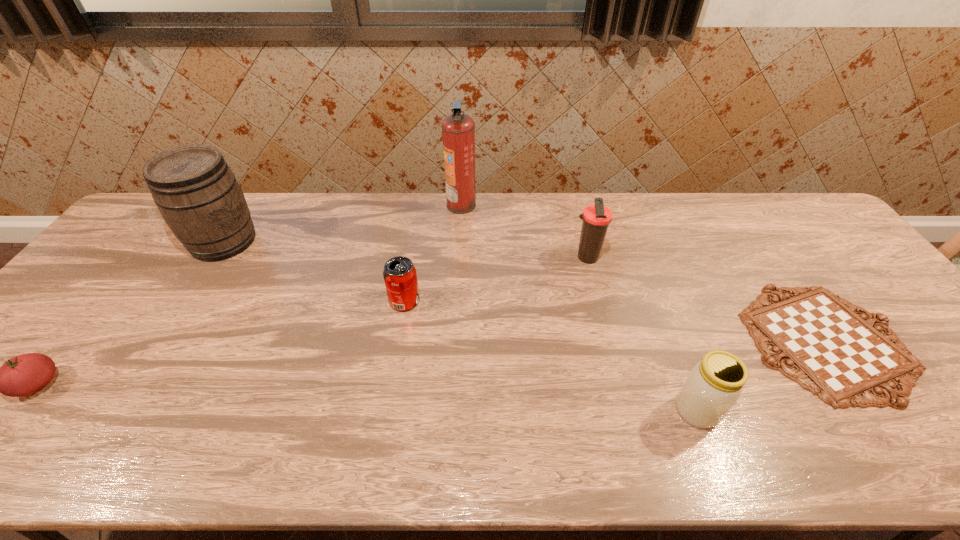
Locate an element on the screen. The height and width of the screenshot is (540, 960). the farthest object is located at coordinates (458, 129).

At what (x,y) coordinates should I click in order to perform the action: click on the fourth object from left to right. Please return your answer as a coordinate pair (x, y). Looking at the image, I should click on (458, 129).

This screenshot has width=960, height=540. What are the coordinates of `the sixth object from right to left` in the screenshot? It's located at (198, 196).

Where is `the sixth shortest object`? The height and width of the screenshot is (540, 960). the sixth shortest object is located at coordinates (198, 196).

Where is `the fifth object from left to right`? the fifth object from left to right is located at coordinates (596, 218).

In order to click on the third tallest object in this screenshot , I will do `click(596, 218)`.

This screenshot has width=960, height=540. Find the location of `jar`. jar is located at coordinates (715, 383).

Locate an element on the screen. The width and height of the screenshot is (960, 540). the fourth shortest object is located at coordinates (715, 383).

Where is `the third shortest object`? The width and height of the screenshot is (960, 540). the third shortest object is located at coordinates (399, 273).

The width and height of the screenshot is (960, 540). Find the location of `the fifth object from right to left`. the fifth object from right to left is located at coordinates (399, 273).